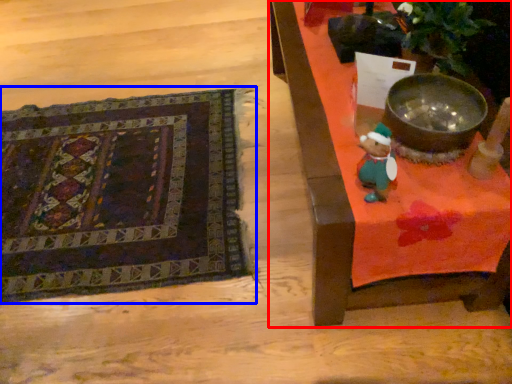
Question: Among these objects, which one is farthest to the camera, furniture (highlighted by a red box) or mat (highlighted by a blue box)?

Choices:
 (A) furniture
 (B) mat

Answer: (B)